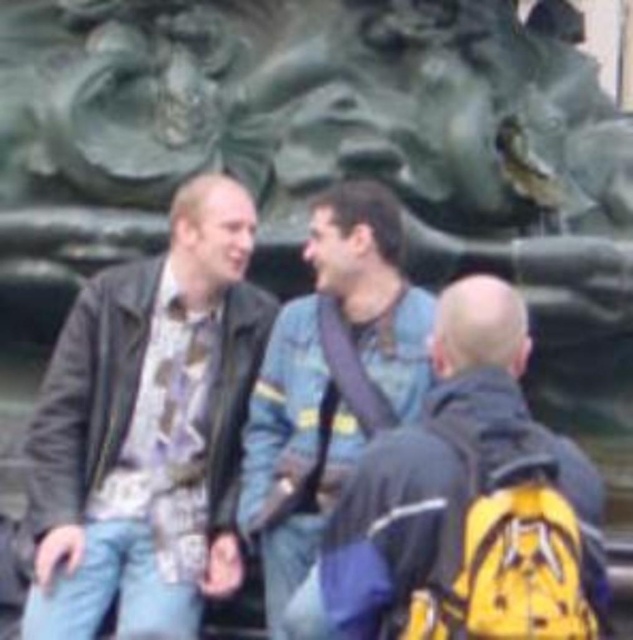
Question: Does matte black jacket at center appear on the right side of yellow backpack at center?

Choices:
 (A) yes
 (B) no

Answer: (B)

Question: Which point is closer to the camera?

Choices:
 (A) (97, 465)
 (B) (453, 396)

Answer: (B)

Question: Is matte black jacket at center further to camera compared to denim jacket at center?

Choices:
 (A) yes
 (B) no

Answer: (B)

Question: Which of the following is the farthest from the observer?

Choices:
 (A) (398, 506)
 (B) (149, 452)
 (C) (284, 563)

Answer: (B)

Question: Which point appears closest to the camera in this image?

Choices:
 (A) (329, 240)
 (B) (173, 433)
 (C) (499, 323)

Answer: (C)

Question: Can you confirm if yellow backpack at center is smaller than denim jacket at center?

Choices:
 (A) no
 (B) yes

Answer: (A)